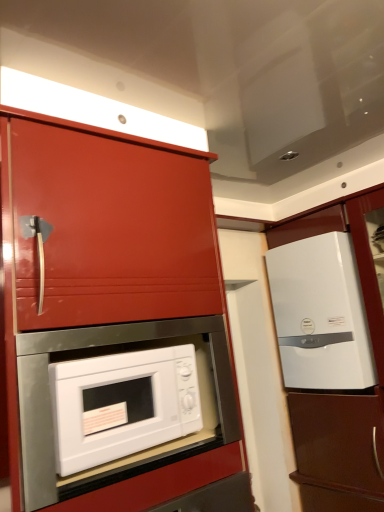
Question: Is white glossy cabinet at right, marked as the 1th cabinetry in a right-to-left arrangement, shorter than glossy red cabinet at center, the 1th cabinetry when ordered from front to back?

Choices:
 (A) no
 (B) yes

Answer: (A)

Question: Is white glossy cabinet at right, marked as the 1th cabinetry in a right-to-left arrangement, located outside glossy red cabinet at center, the 1th cabinetry when ordered from front to back?

Choices:
 (A) no
 (B) yes

Answer: (B)

Question: Is white glossy cabinet at right, which is counted as the 2th cabinetry, starting from the front, in contact with glossy red cabinet at center, the 1th cabinetry when ordered from front to back?

Choices:
 (A) no
 (B) yes

Answer: (A)

Question: Is white glossy cabinet at right, the second cabinetry viewed from the left, thinner than glossy red cabinet at center, arranged as the second cabinetry when viewed from the right?

Choices:
 (A) no
 (B) yes

Answer: (B)

Question: Could you tell me if white glossy cabinet at right, the second cabinetry viewed from the left, is turned towards glossy red cabinet at center, arranged as the second cabinetry when viewed from the right?

Choices:
 (A) yes
 (B) no

Answer: (A)

Question: Is white glossy refrigerator at right in front of or behind white glossy microwave at center in the image?

Choices:
 (A) behind
 (B) front

Answer: (A)

Question: Looking at their shapes, would you say white glossy refrigerator at right is wider or thinner than white glossy microwave at center?

Choices:
 (A) thin
 (B) wide

Answer: (B)

Question: From a real-world perspective, relative to white glossy microwave at center, is white glossy refrigerator at right vertically above or below?

Choices:
 (A) below
 (B) above

Answer: (B)

Question: In terms of height, does white glossy refrigerator at right look taller or shorter compared to white glossy microwave at center?

Choices:
 (A) tall
 (B) short

Answer: (A)

Question: Considering the positions of white glossy microwave at center and glossy red cabinet at center, the 1th cabinetry when ordered from front to back, in the image, is white glossy microwave at center taller or shorter than glossy red cabinet at center, the 1th cabinetry when ordered from front to back,?

Choices:
 (A) short
 (B) tall

Answer: (A)

Question: From the image's perspective, is white glossy microwave at center positioned above or below glossy red cabinet at center, which is the second cabinetry from back to front?

Choices:
 (A) below
 (B) above

Answer: (A)

Question: Looking at their shapes, would you say white glossy microwave at center is wider or thinner than glossy red cabinet at center, the first cabinetry positioned from the left?

Choices:
 (A) thin
 (B) wide

Answer: (A)

Question: Would you say white glossy microwave at center is to the left or to the right of glossy red cabinet at center, the first cabinetry positioned from the left, in the picture?

Choices:
 (A) right
 (B) left

Answer: (A)

Question: In terms of size, does glossy red cabinet at center, the first cabinetry positioned from the left, appear bigger or smaller than white glossy cabinet at right, which is counted as the 2th cabinetry, starting from the front?

Choices:
 (A) big
 (B) small

Answer: (A)

Question: From the image's perspective, is glossy red cabinet at center, the first cabinetry positioned from the left, above or below white glossy cabinet at right, the 1th cabinetry from the back?

Choices:
 (A) above
 (B) below

Answer: (A)